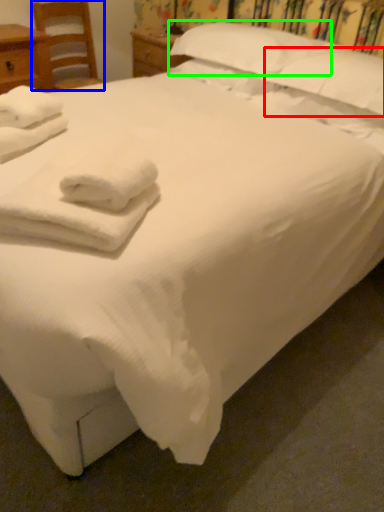
Question: Estimate the real-world distances between objects in this image. Which object is closer to pillow (highlighted by a red box), chair (highlighted by a blue box) or pillow (highlighted by a green box)?

Choices:
 (A) chair
 (B) pillow

Answer: (B)